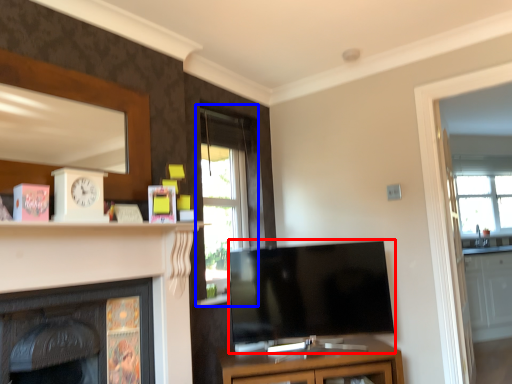
Question: Among these objects, which one is nearest to the camera, television (highlighted by a red box) or window (highlighted by a blue box)?

Choices:
 (A) television
 (B) window

Answer: (A)